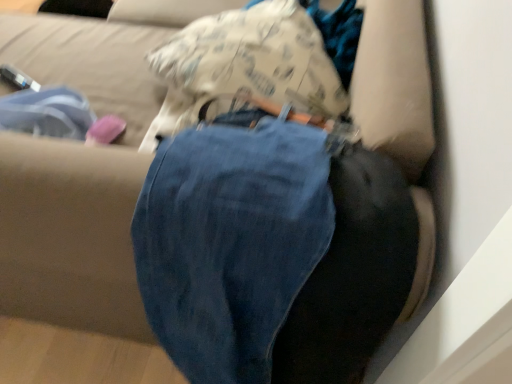
Image resolution: width=512 pixels, height=384 pixels. Describe the element at coordinates (255, 58) in the screenshot. I see `patterned fabric pillow at upper center` at that location.

Identify the location of patterned fabric pillow at upper center. Image resolution: width=512 pixels, height=384 pixels. (255, 58).

I want to click on patterned fabric pillow at upper center, so click(x=255, y=58).